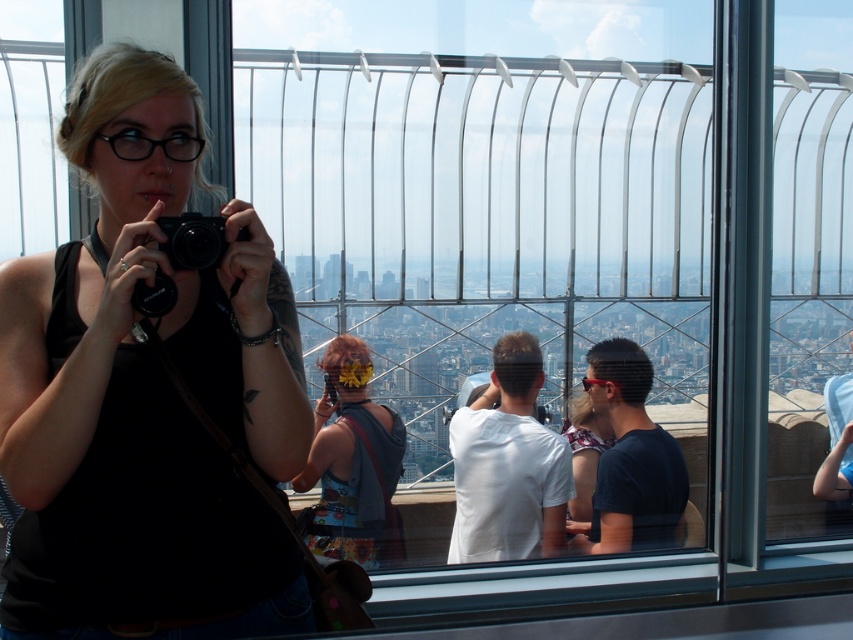
Is point (199, 275) in front of point (244, 237)?

No.

Locate an element on the screen. matte black camera at left is located at coordinates (146, 394).

What do you see at coordinates (146, 394) in the screenshot?
I see `matte black camera at left` at bounding box center [146, 394].

Which of these two, matte black camera at left or white matte shirt at center, stands shorter?

Standing shorter between the two is white matte shirt at center.

Does point (151, 620) come farther from viewer compared to point (518, 477)?

No, (151, 620) is closer to viewer.

Find the location of `matte black camera at left`. matte black camera at left is located at coordinates (146, 394).

Is point (364, 346) farther from camera compared to point (177, 248)?

Yes, it is behind point (177, 248).

Who is lower down, floral dress at center or black plastic camera at center?

floral dress at center is lower down.

Locate an element on the screen. The image size is (853, 640). floral dress at center is located at coordinates (352, 465).